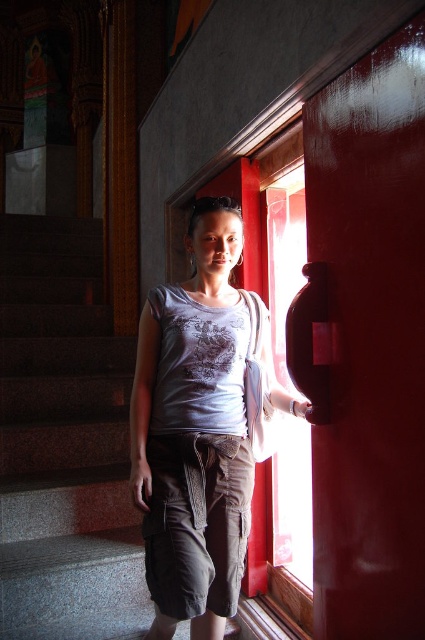
You are a delivery person trying to reach the apartment on the second floor. You see the gray granite stairs at left and the matte gray shirt at center. Which direction should you go to ascend the stairs?

You should go to the left of the matte gray shirt at center to ascend the stairs since the gray granite stairs at left are located to the left of the matte gray shirt at center.

You are a painter who needs to decide which object to paint first based on their size. You have to choose between the gray granite stairs at left and the matte gray shirt at center. Which object should you paint first?

The gray granite stairs at left is larger in size than the matte gray shirt at center, so you should paint the gray granite stairs at left first.